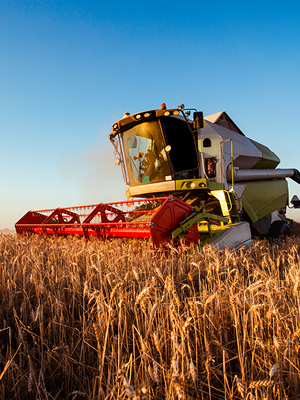
Locate an element on the screen. Image resolution: width=300 pixels, height=400 pixels. fire extinguisher is located at coordinates (209, 167).